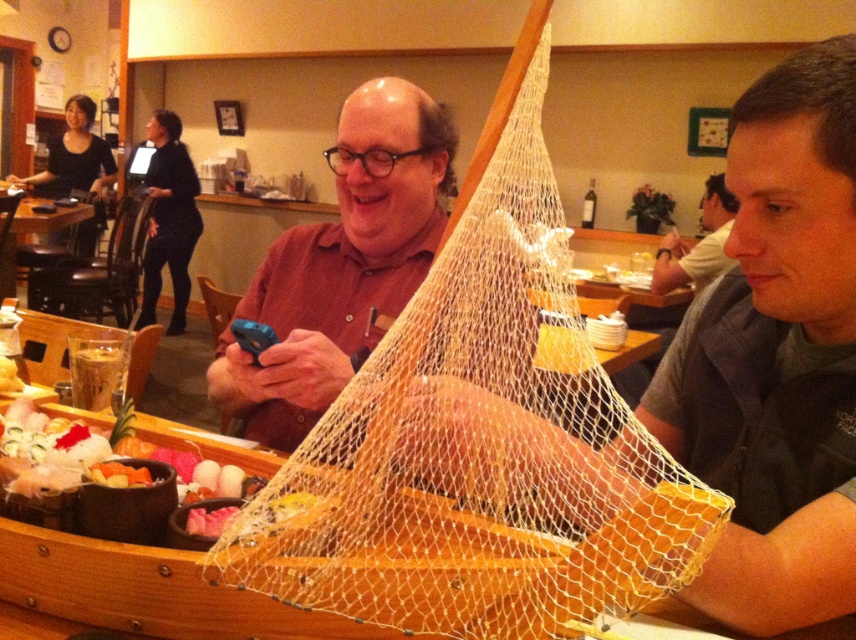
You are a customer at the sushi counter. You want to take a photo of the dishes under the white mesh net at center without blocking the view of the gray fabric shirt at right. Is this possible?

The white mesh net at center is in front of the gray fabric shirt at right, so taking a photo of the dishes under the white mesh net at center without blocking the view of the gray fabric shirt at right is not possible because the net is directly in front of the shirt.

You are a customer sitting at the sushi counter. You want to place your phone on the counter without it falling off. Which object between the white mesh net at center and the matte brown shirt at center should you place it closer to?

The white mesh net at center is located below the matte brown shirt at center, so placing the phone closer to the white mesh net at center would keep it stable on the counter.

You are a customer at the sushi counter. You want to place your phone between the white mesh net at center and the matte brown shirt at center. Can you fit your phone there?

The white mesh net at center is wider than the matte brown shirt at center. Therefore, there is sufficient space between them to place your phone.